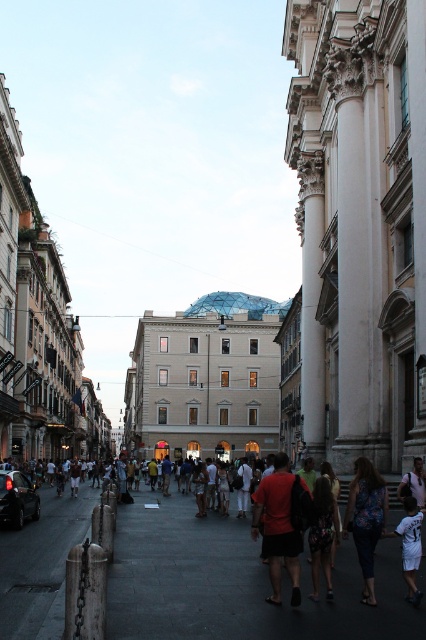
Who is more distant from viewer, (344, 536) or (417, 605)?

Positioned behind is point (344, 536).

Does point (373, 582) lie in front of point (420, 595)?

No, it is not.

Locate an element on the screen. The height and width of the screenshot is (640, 426). floral-patterned fabric at center-right is located at coordinates (365, 518).

Which of these two, white cotton shirt at lower right or shiny black car at lower left, stands taller?

With more height is shiny black car at lower left.

Between white cotton shirt at lower right and shiny black car at lower left, which one is positioned lower?

shiny black car at lower left

Which is behind, point (411, 508) or point (11, 508)?

The point (11, 508) is more distant.

Locate an element on the screen. white cotton shirt at lower right is located at coordinates (409, 547).

Who is taller, white cotton shirt at lower right or light brown leather backpack at lower right?

With more height is white cotton shirt at lower right.

Describe the element at coordinates (409, 547) in the screenshot. The height and width of the screenshot is (640, 426). I see `white cotton shirt at lower right` at that location.

Measure the distance between white cotton shirt at lower right and camera.

white cotton shirt at lower right and camera are 41.76 meters apart.

Where is `white cotton shirt at lower right`? white cotton shirt at lower right is located at coordinates (409, 547).